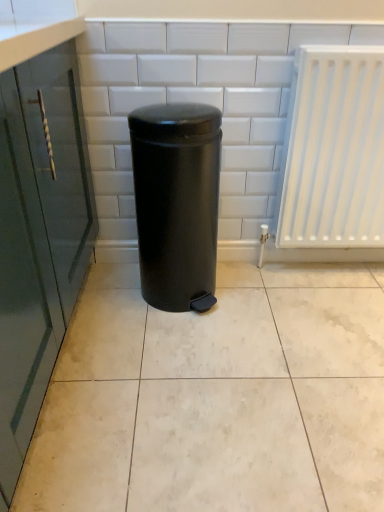
Question: Would you say black matte waste container at center is to the left or to the right of white plastic radiator at right in the picture?

Choices:
 (A) right
 (B) left

Answer: (B)

Question: Considering the positions of point (135, 124) and point (317, 89), is point (135, 124) closer or farther from the camera than point (317, 89)?

Choices:
 (A) farther
 (B) closer

Answer: (B)

Question: Which object is the closest to the black matte waste container at center?

Choices:
 (A) white glossy ceramic tile at center
 (B) white plastic radiator at right

Answer: (A)

Question: Which is nearer to the white glossy ceramic tile at center?

Choices:
 (A) white plastic radiator at right
 (B) black matte waste container at center

Answer: (B)